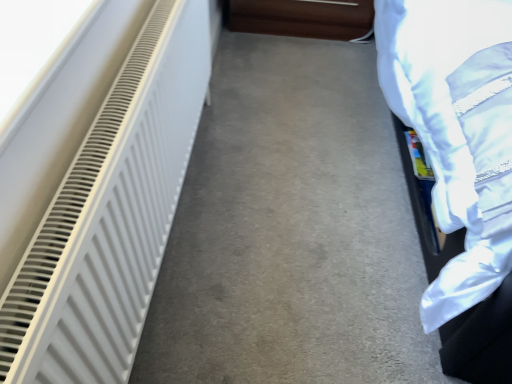
Locate an element on the screen. white matte radiator at left is located at coordinates (111, 214).

In order to face brown leather couch at upper center, should I rotate leftwards or rightwards?

To align with it, rotate right about 6.269°.

Describe the element at coordinates (291, 230) in the screenshot. I see `white matte radiator at left` at that location.

What are the coordinates of `white matte radiator at left` in the screenshot? It's located at (291, 230).

At what (x,y) coordinates should I click in order to perform the action: click on white matte radiator at left. Please return your answer as a coordinate pair (x, y). Looking at the image, I should click on (111, 214).

Consider the image. Considering the relative sizes of brown leather couch at upper center and white matte radiator at left in the image provided, is brown leather couch at upper center taller than white matte radiator at left?

In fact, brown leather couch at upper center may be shorter than white matte radiator at left.

Would you say brown leather couch at upper center is inside or outside white matte radiator at left?

brown leather couch at upper center is not inside white matte radiator at left, it's outside.

Which object is thinner, brown leather couch at upper center or white matte radiator at left?

Thinner between the two is white matte radiator at left.

Which object is closer to the camera, brown leather couch at upper center or white matte radiator at left?

white matte radiator at left is in front.

Between white matte radiator at left and brown leather couch at upper center, which one is positioned behind?

brown leather couch at upper center is more distant.

Is white matte radiator at left not inside brown leather couch at upper center?

Yes, white matte radiator at left is outside of brown leather couch at upper center.

At what (x,y) coordinates should I click in order to perform the action: click on furniture behind the white matte radiator at left. Please return your answer as a coordinate pair (x, y). The height and width of the screenshot is (384, 512). Looking at the image, I should click on (303, 18).

In the scene shown: Measure the distance between white matte radiator at left and brown leather couch at upper center.

4.18 feet.

Which object is positioned more to the left, brown leather couch at upper center or white matte radiator at left?

white matte radiator at left is more to the left.

Can you confirm if brown leather couch at upper center is thinner than white matte radiator at left?

Yes.

From a real-world perspective, does brown leather couch at upper center stand above white matte radiator at left?

Yes, from a real-world perspective, brown leather couch at upper center is above white matte radiator at left.

Where is `furniture above the white matte radiator at left (from a real-world perspective)`? Image resolution: width=512 pixels, height=384 pixels. furniture above the white matte radiator at left (from a real-world perspective) is located at coordinates (303, 18).

Can you confirm if white matte radiator at left is positioned to the right of white matte radiator at left?

Incorrect, white matte radiator at left is not on the right side of white matte radiator at left.

I want to click on radiator on the left of white matte radiator at left, so click(111, 214).

Looking at this image, from the image's perspective, is white matte radiator at left beneath white matte radiator at left?

Correct, white matte radiator at left appears lower than white matte radiator at left in the image.

Based on the photo, between white matte radiator at left and white matte radiator at left, which one has smaller size?

white matte radiator at left is smaller.

Does point (298, 212) come farther from viewer compared to point (324, 7)?

That is False.

Which object is further away from the camera taking this photo, white matte radiator at left or brown leather couch at upper center?

Positioned behind is brown leather couch at upper center.

How much distance is there between white matte radiator at left and brown leather couch at upper center?

They are 34.01 inches apart.

Are white matte radiator at left and brown leather couch at upper center beside each other?

No, white matte radiator at left is not next to brown leather couch at upper center.

From a real-world perspective, who is located higher, white matte radiator at left or white matte radiator at left?

white matte radiator at left, from a real-world perspective.

Is white matte radiator at left facing away from white matte radiator at left?

No, white matte radiator at left is not facing away from white matte radiator at left.

From the image's perspective, which object appears higher, white matte radiator at left or white matte radiator at left?

From the image's view, white matte radiator at left is above.

Which of these two, white matte radiator at left or white matte radiator at left, is thinner?

white matte radiator at left is thinner.

Locate an element on the screen. furniture that appears behind the white matte radiator at left is located at coordinates (303, 18).

At what (x,y) coordinates should I click in order to perform the action: click on furniture on the right side of white matte radiator at left. Please return your answer as a coordinate pair (x, y). The image size is (512, 384). Looking at the image, I should click on (303, 18).

When comparing their distances from white matte radiator at left, does brown leather couch at upper center or white matte radiator at left seem closer?

white matte radiator at left is closer to white matte radiator at left.

Looking at the image, which one is located closer to white matte radiator at left, white matte radiator at left or brown leather couch at upper center?

white matte radiator at left.

In the scene shown: Estimate the real-world distances between objects in this image. Which object is further from white matte radiator at left, brown leather couch at upper center or white matte radiator at left?

brown leather couch at upper center.

Based on their spatial positions, is white matte radiator at left or brown leather couch at upper center closer to white matte radiator at left?

white matte radiator at left is closer to white matte radiator at left.

Estimate the real-world distances between objects in this image. Which object is further from brown leather couch at upper center, white matte radiator at left or white matte radiator at left?

white matte radiator at left is positioned further to the anchor brown leather couch at upper center.

Looking at the image, which one is located further to brown leather couch at upper center, white matte radiator at left or white matte radiator at left?

Based on the image, white matte radiator at left appears to be further to brown leather couch at upper center.

What are the coordinates of `concrete between white matte radiator at left and brown leather couch at upper center in the front-back direction` in the screenshot? It's located at (291, 230).